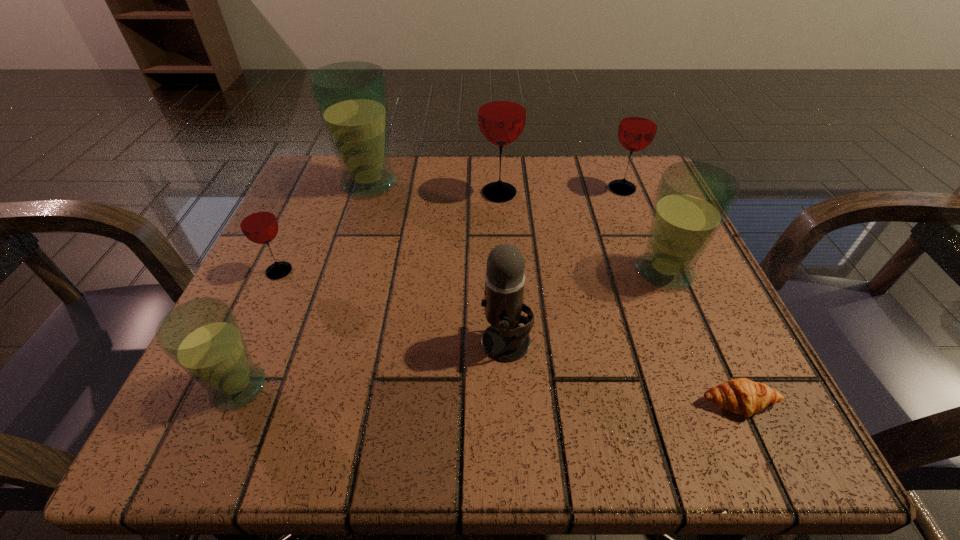
This screenshot has width=960, height=540. I want to click on the fourth glass from left to right, so click(x=502, y=108).

You are a GUI agent. You are given a task and a screenshot of the screen. Output one action in this format:
    pyautogui.click(x=<x>, y=<y>)
    Task: Click on the second red glass from right to left
    The width and height of the screenshot is (960, 540).
    Given the screenshot: What is the action you would take?
    pyautogui.click(x=502, y=108)

The image size is (960, 540). What are the coordinates of `the farthest blue glass` in the screenshot? It's located at (351, 97).

Locate an element on the screen. Image resolution: width=960 pixels, height=540 pixels. the second smallest red glass is located at coordinates (x=638, y=125).

Locate an element on the screen. the second biggest blue glass is located at coordinates (693, 199).

Find the location of a particular element. The height and width of the screenshot is (540, 960). the second nearest blue glass is located at coordinates (693, 199).

This screenshot has width=960, height=540. I want to click on gray microphone, so click(x=504, y=340).

Locate an element on the screen. Image resolution: width=960 pixels, height=540 pixels. the smallest red glass is located at coordinates (258, 223).

The width and height of the screenshot is (960, 540). I want to click on the leftmost red glass, so click(258, 223).

At what (x,y) coordinates should I click in order to perform the action: click on the nearest blue glass. Please return your answer as a coordinate pair (x, y). The width and height of the screenshot is (960, 540). Looking at the image, I should click on (202, 336).